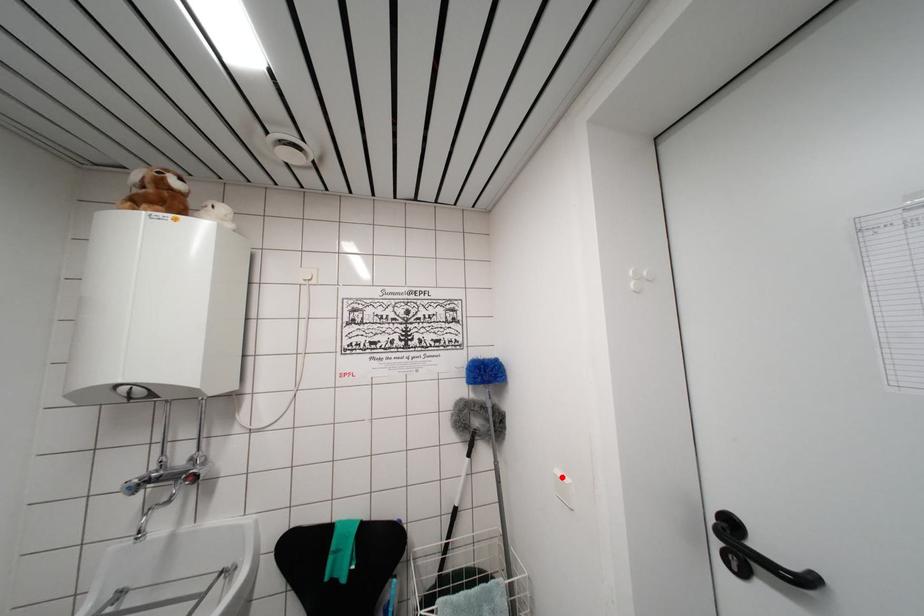
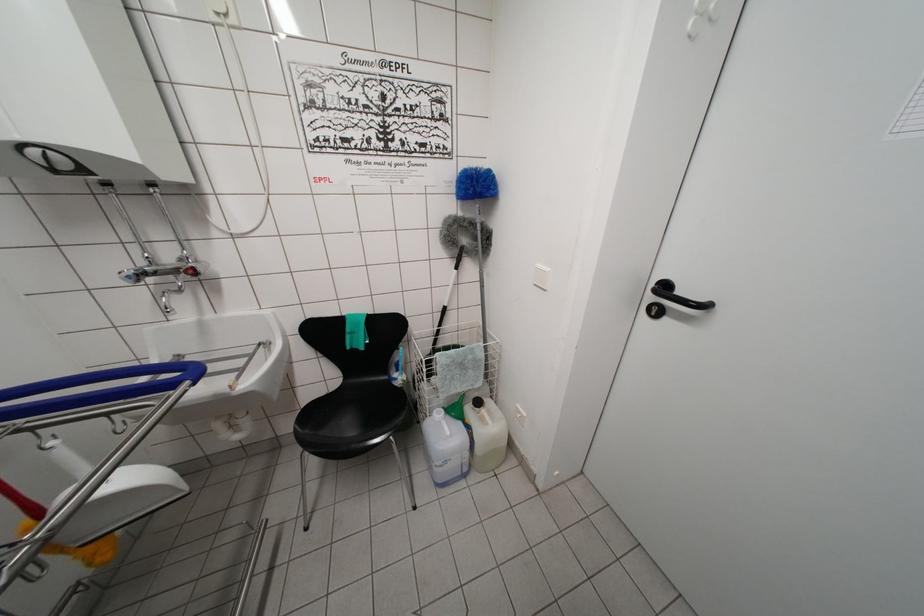
Where in the second image is the point corresponding to the highlighted location from the first image?

(542, 270)